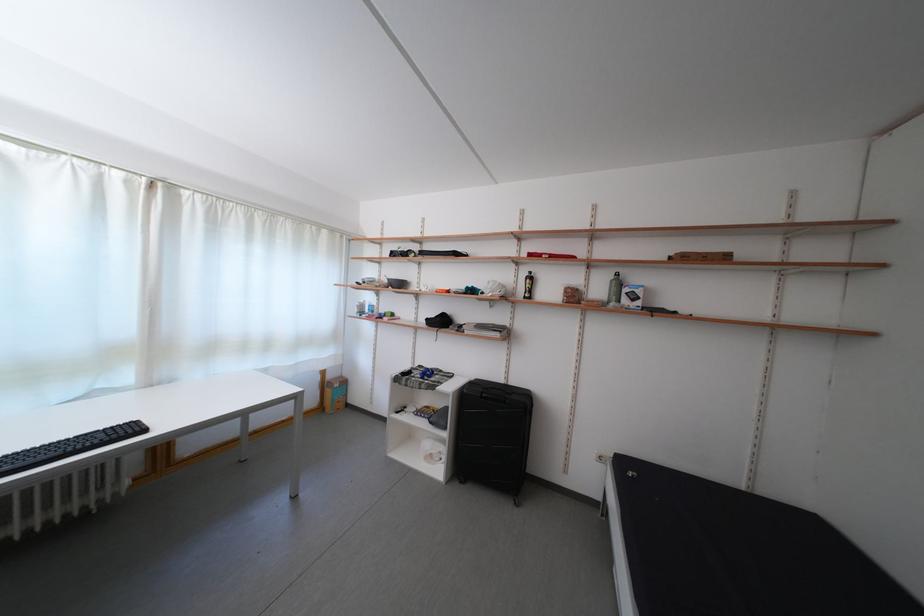
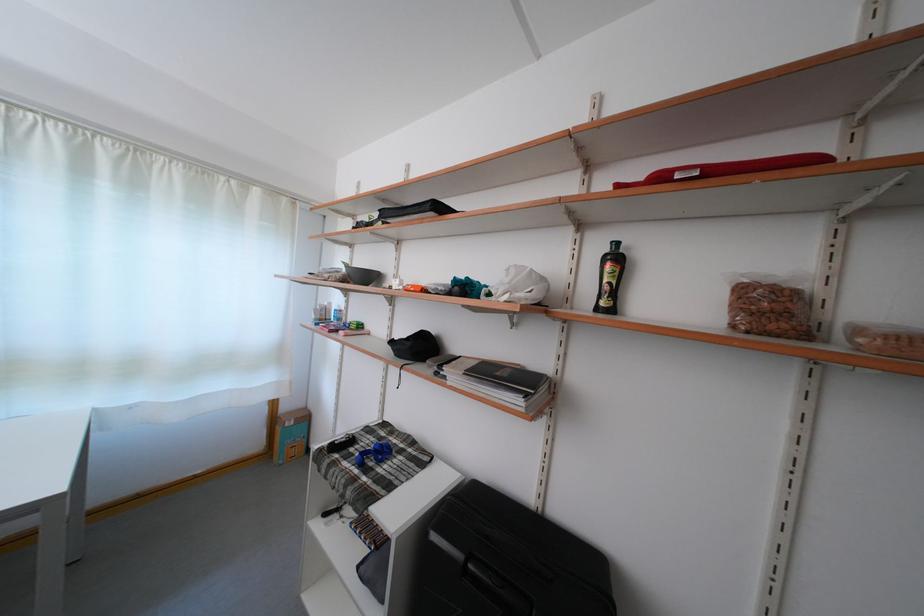
Find the pixel in the second image that matches (x=338, y=382) in the first image.

(293, 415)